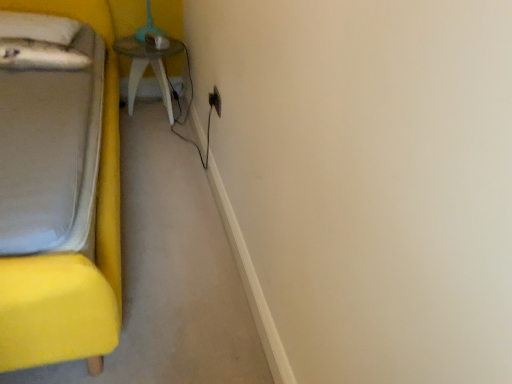
The width and height of the screenshot is (512, 384). In order to click on black plastic electric outlet at upper center in this screenshot , I will do `click(215, 101)`.

Identify the location of white soft pillow at upper left. Image resolution: width=512 pixels, height=384 pixels. (38, 27).

How much distance is there between black plastic electric outlet at upper center and yellow fabric bed at left?

black plastic electric outlet at upper center is 29.77 inches away from yellow fabric bed at left.

Does black plastic electric outlet at upper center have a larger size compared to yellow fabric bed at left?

No, black plastic electric outlet at upper center is not bigger than yellow fabric bed at left.

Considering the relative sizes of black plastic electric outlet at upper center and yellow fabric bed at left in the image provided, is black plastic electric outlet at upper center thinner than yellow fabric bed at left?

Yes, black plastic electric outlet at upper center is thinner than yellow fabric bed at left.

Is black plastic electric outlet at upper center inside or outside of yellow fabric bed at left?

black plastic electric outlet at upper center is not inside yellow fabric bed at left, it's outside.

Which is further, (x=66, y=22) or (x=102, y=224)?

The point (x=66, y=22) is farther.

At what (x,y) coordinates should I click in order to perform the action: click on pillow above the yellow fabric bed at left (from a real-world perspective). Please return your answer as a coordinate pair (x, y). This screenshot has height=384, width=512. Looking at the image, I should click on (38, 27).

Does white soft pillow at upper left have a lesser width compared to yellow fabric bed at left?

Yes, white soft pillow at upper left is thinner than yellow fabric bed at left.

Is white soft pillow at upper left at the right side of yellow fabric bed at left?

No, white soft pillow at upper left is not to the right of yellow fabric bed at left.

Is wooden table at center in contact with black plastic electric outlet at upper center?

No, wooden table at center is not in contact with black plastic electric outlet at upper center.

Which of these two, wooden table at center or black plastic electric outlet at upper center, is wider?

Wider between the two is wooden table at center.

Considering the relative positions of wooden table at center and black plastic electric outlet at upper center in the image provided, is wooden table at center behind black plastic electric outlet at upper center?

Yes, the depth of wooden table at center is greater than that of black plastic electric outlet at upper center.

Considering the sizes of objects yellow fabric bed at left and wooden table at center in the image provided, who is thinner, yellow fabric bed at left or wooden table at center?

wooden table at center.

Relative to wooden table at center, is yellow fabric bed at left in front or behind?

yellow fabric bed at left is positioned closer to the viewer than wooden table at center.

Considering the sizes of objects yellow fabric bed at left and wooden table at center in the image provided, who is taller, yellow fabric bed at left or wooden table at center?

With more height is yellow fabric bed at left.

From the image's perspective, does black plastic electric outlet at upper center appear lower than white soft pillow at upper left?

Indeed, from the image's perspective, black plastic electric outlet at upper center is shown beneath white soft pillow at upper left.

Considering the relative sizes of black plastic electric outlet at upper center and white soft pillow at upper left in the image provided, is black plastic electric outlet at upper center smaller than white soft pillow at upper left?

Correct, black plastic electric outlet at upper center occupies less space than white soft pillow at upper left.

Is black plastic electric outlet at upper center next to white soft pillow at upper left and touching it?

black plastic electric outlet at upper center and white soft pillow at upper left are not in contact.

Is black plastic electric outlet at upper center oriented towards white soft pillow at upper left?

No.

Does yellow fabric bed at left have a greater height compared to black plastic electric outlet at upper center?

Yes.

Is yellow fabric bed at left at the right side of black plastic electric outlet at upper center?

Incorrect, yellow fabric bed at left is not on the right side of black plastic electric outlet at upper center.

From a real-world perspective, is yellow fabric bed at left physically located above or below black plastic electric outlet at upper center?

Answer: yellow fabric bed at left is below black plastic electric outlet at upper center.

Is yellow fabric bed at left not within black plastic electric outlet at upper center?

Yes, yellow fabric bed at left is not within black plastic electric outlet at upper center.

In the scene shown: Is black plastic electric outlet at upper center next to wooden table at center?

No.

Can you tell me how much black plastic electric outlet at upper center and wooden table at center differ in facing direction?

There is a 87.9-degree angle between the facing directions of black plastic electric outlet at upper center and wooden table at center.

Considering the relative sizes of black plastic electric outlet at upper center and wooden table at center in the image provided, is black plastic electric outlet at upper center smaller than wooden table at center?

Yes, black plastic electric outlet at upper center is smaller than wooden table at center.

Considering the points (212, 101) and (134, 94), which point is behind, point (212, 101) or point (134, 94)?

The point (134, 94) is farther.

Identify the location of furniture in front of the black plastic electric outlet at upper center. The image size is (512, 384). (70, 254).

You are a GUI agent. You are given a task and a screenshot of the screen. Output one action in this format:
    pyautogui.click(x=<x>, y=<y>)
    Task: Click on the furniture below the white soft pillow at upper left (from a real-world perspective)
    This screenshot has width=512, height=384.
    Given the screenshot: What is the action you would take?
    pyautogui.click(x=70, y=254)

Based on their spatial positions, is wooden table at center or yellow fabric bed at left further from black plastic electric outlet at upper center?

yellow fabric bed at left.

Considering their positions, is yellow fabric bed at left positioned further to black plastic electric outlet at upper center than wooden table at center?

The object further to black plastic electric outlet at upper center is yellow fabric bed at left.

Considering their positions, is wooden table at center positioned further to yellow fabric bed at left than white soft pillow at upper left?

Among the two, wooden table at center is located further to yellow fabric bed at left.

Considering their positions, is black plastic electric outlet at upper center positioned closer to white soft pillow at upper left than wooden table at center?

wooden table at center.

When comparing their distances from wooden table at center, does yellow fabric bed at left or black plastic electric outlet at upper center seem closer?

black plastic electric outlet at upper center is positioned closer to the anchor wooden table at center.

From the image, which object appears to be farther from yellow fabric bed at left, black plastic electric outlet at upper center or wooden table at center?

black plastic electric outlet at upper center lies further to yellow fabric bed at left than the other object.

Which object lies nearer to the anchor point wooden table at center, white soft pillow at upper left or yellow fabric bed at left?

white soft pillow at upper left is positioned closer to the anchor wooden table at center.

Estimate the real-world distances between objects in this image. Which object is closer to white soft pillow at upper left, yellow fabric bed at left or black plastic electric outlet at upper center?

The object closer to white soft pillow at upper left is yellow fabric bed at left.

You are a GUI agent. You are given a task and a screenshot of the screen. Output one action in this format:
    pyautogui.click(x=<x>, y=<y>)
    Task: Click on the electric outlet located between yellow fabric bed at left and wooden table at center in the depth direction
    Image resolution: width=512 pixels, height=384 pixels.
    Given the screenshot: What is the action you would take?
    pyautogui.click(x=215, y=101)

Locate an element on the screen. electric outlet positioned between yellow fabric bed at left and white soft pillow at upper left from near to far is located at coordinates (215, 101).

Identify the location of table between white soft pillow at upper left and black plastic electric outlet at upper center in the horizontal direction. The image size is (512, 384). (146, 67).

Locate an element on the screen. Image resolution: width=512 pixels, height=384 pixels. pillow positioned between yellow fabric bed at left and wooden table at center from near to far is located at coordinates (38, 27).